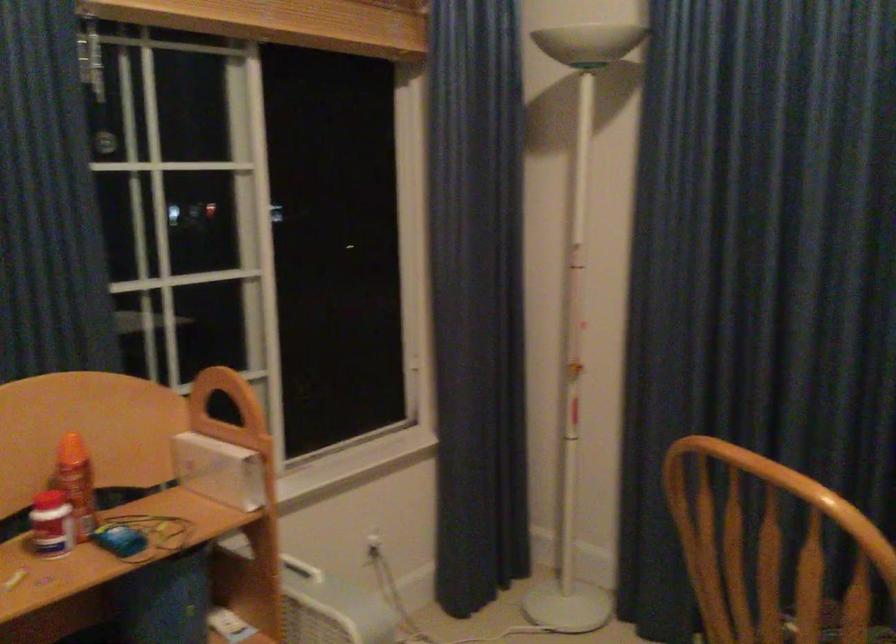
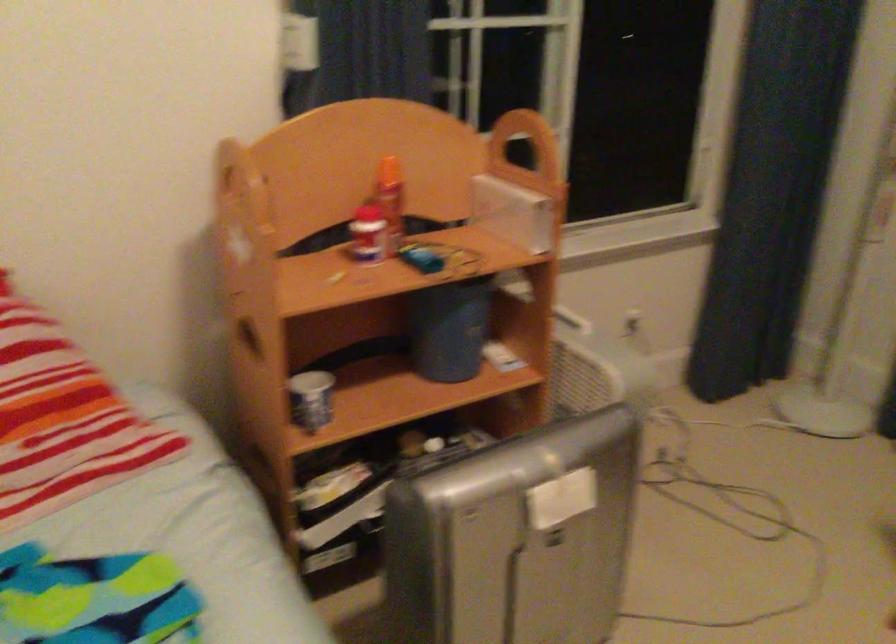
In the second image, find the point that corresponds to point 90,474 in the first image.

(391, 200)